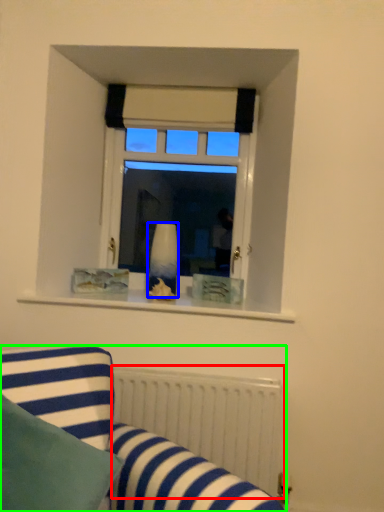
Question: Considering the real-world distances, which object is farthest from radiator (highlighted by a red box)? vase (highlighted by a blue box) or studio couch (highlighted by a green box)?

Choices:
 (A) vase
 (B) studio couch

Answer: (A)